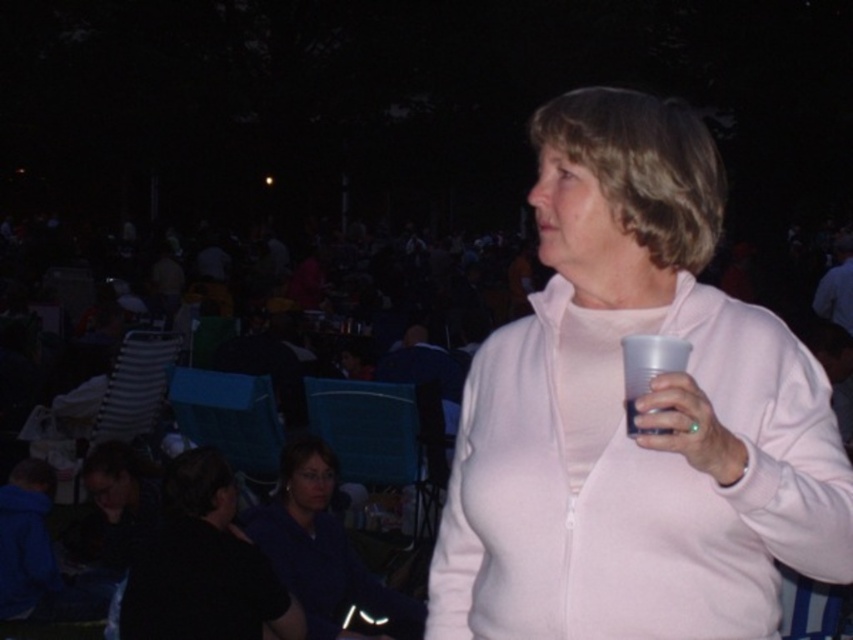
You are a photographer at the event and want to capture a photo that includes both the matte blue shirt at lower center and the translucent plastic cup at right. Based on their positions, which object should you focus on first to ensure both are in frame?

The matte blue shirt at lower center is located below the translucent plastic cup at right, so you should focus on the translucent plastic cup at right first to ensure both are in frame.